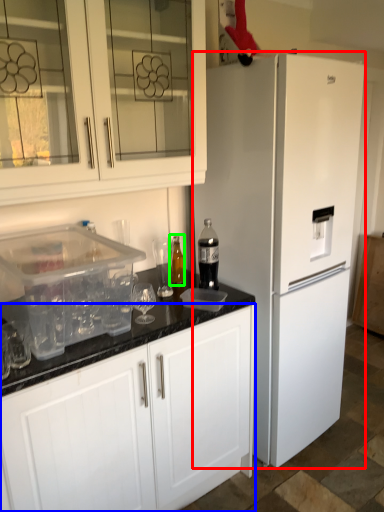
Question: Which object is positioned farthest from refrigerator (highlighted by a red box)? Select from cabinetry (highlighted by a blue box) and bottle (highlighted by a green box).

Choices:
 (A) cabinetry
 (B) bottle

Answer: (B)